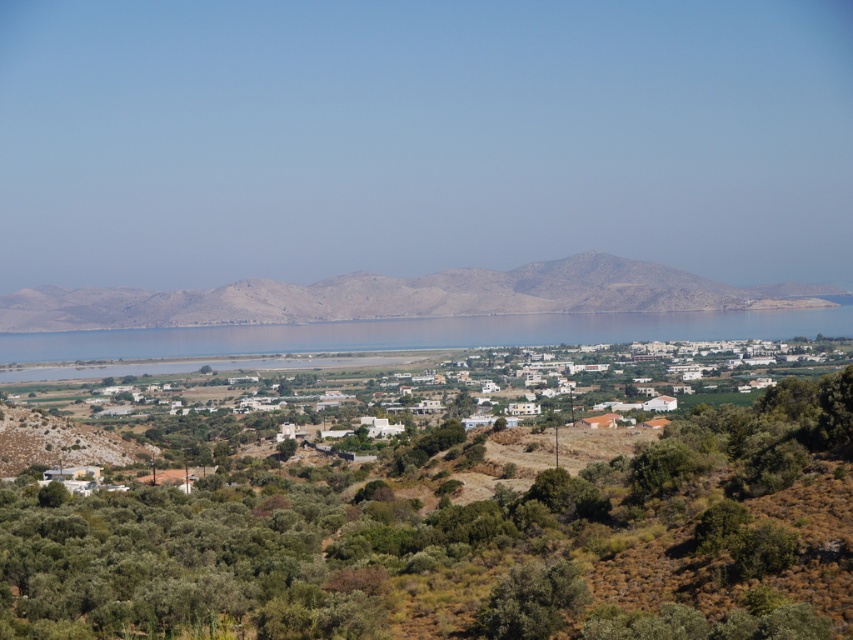
You are a drone operator tasked with capturing aerial footage of the coastal landscape. Your drone is currently positioned at point A, which is at coordinates 0.3, 0.2. You need to fly it to the white matte houses at center. Which direction should you steer the drone to reach them?

The white matte houses at center are located at point (354, 365). Since the drone is at (170, 192), it needs to move northeast to reach them.

Consider the image. You are a hiker planning to cross the blue water at center to reach the dull brown mountain at center. Based on the scene, is the mountain located behind or in front of the water?

The dull brown mountain at center is positioned over blue water at center, which means the mountain is behind the water from your perspective.